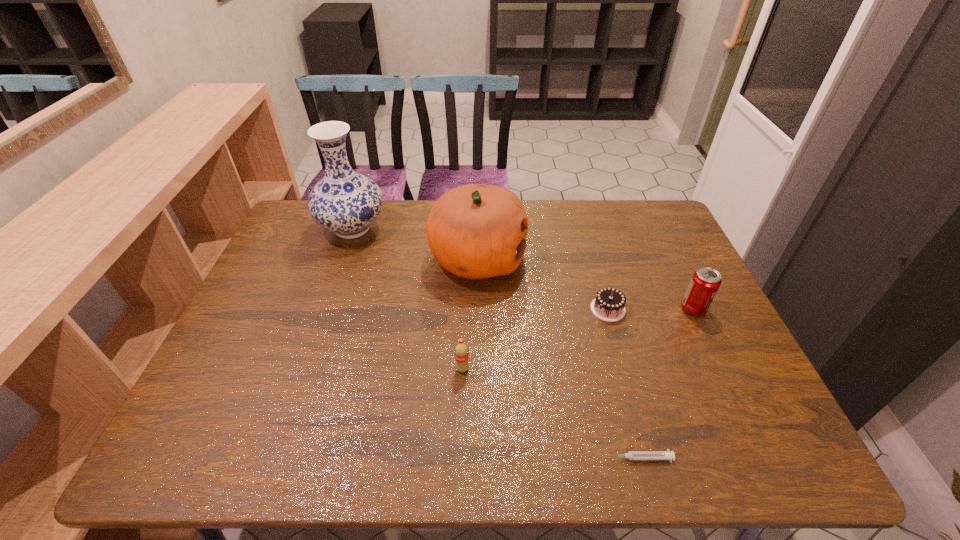
Locate an element on the screen. This screenshot has width=960, height=540. free point at the far right corner is located at coordinates (656, 211).

The image size is (960, 540). In order to click on empty space that is in between the second tallest object and the right soda in this screenshot , I will do `click(586, 284)`.

This screenshot has height=540, width=960. In order to click on free area in between the pumpkin and the fifth tallest object in this screenshot , I will do `click(542, 284)`.

The image size is (960, 540). Identify the location of free space between the nearest object and the pumpkin. (558, 359).

In order to click on vacant area between the tallest object and the fourth tallest object in this screenshot , I will do `click(407, 299)`.

You are a GUI agent. You are given a task and a screenshot of the screen. Output one action in this format:
    pyautogui.click(x=<x>, y=<y>)
    Task: Click on the free spot between the tallest object and the left soda
    The image size is (960, 540).
    Given the screenshot: What is the action you would take?
    pyautogui.click(x=407, y=299)

Identify the location of blank region between the right soda and the syringe. The image size is (960, 540). (666, 383).

Where is `vacant region between the nearer soda and the shortest object`? This screenshot has width=960, height=540. vacant region between the nearer soda and the shortest object is located at coordinates (551, 414).

Where is `vacant point located between the chocolate cake and the pumpkin`? The height and width of the screenshot is (540, 960). vacant point located between the chocolate cake and the pumpkin is located at coordinates pos(542,284).

Where is `empty space between the right soda and the syringe`? This screenshot has width=960, height=540. empty space between the right soda and the syringe is located at coordinates (666, 383).